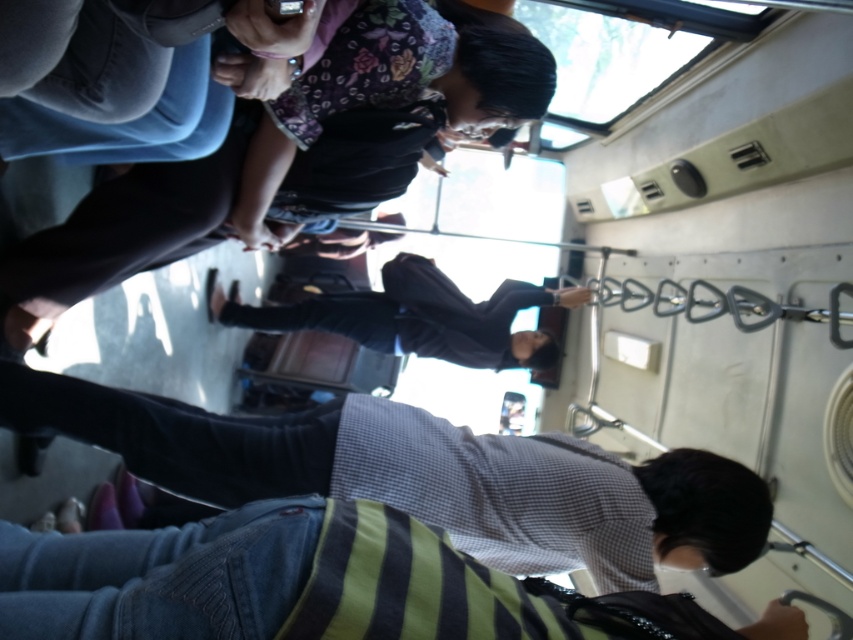
I want to click on striped sweater at lower center, so 248,580.

Between point (403, 577) and point (563, 301), which one is positioned behind?

The point (563, 301) is more distant.

Find the location of a particular element. The height and width of the screenshot is (640, 853). striped sweater at lower center is located at coordinates (248, 580).

Looking at this image, is striped shirt at lower center behind dark blue fabric jacket at center?

No, striped shirt at lower center is closer to the viewer.

Between striped shirt at lower center and dark blue fabric jacket at center, which one appears on the left side from the viewer's perspective?

Positioned to the left is dark blue fabric jacket at center.

Locate an element on the screen. The image size is (853, 640). striped shirt at lower center is located at coordinates (422, 476).

Between striped shirt at lower center and striped sweater at lower center, which one has less height?

striped sweater at lower center is shorter.

Can you confirm if striped shirt at lower center is taller than striped sweater at lower center?

Yes, striped shirt at lower center is taller than striped sweater at lower center.

This screenshot has width=853, height=640. I want to click on striped shirt at lower center, so click(422, 476).